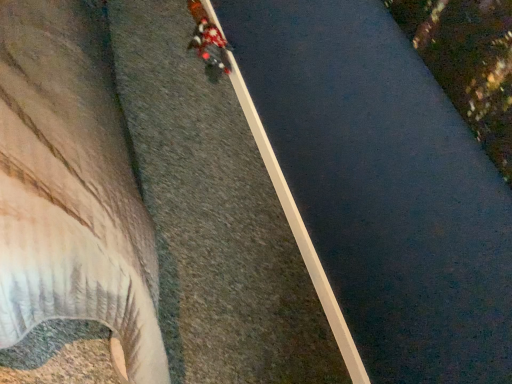
I want to click on blank space above smooth concrete waterway at center (from a real-world perspective), so click(x=276, y=168).